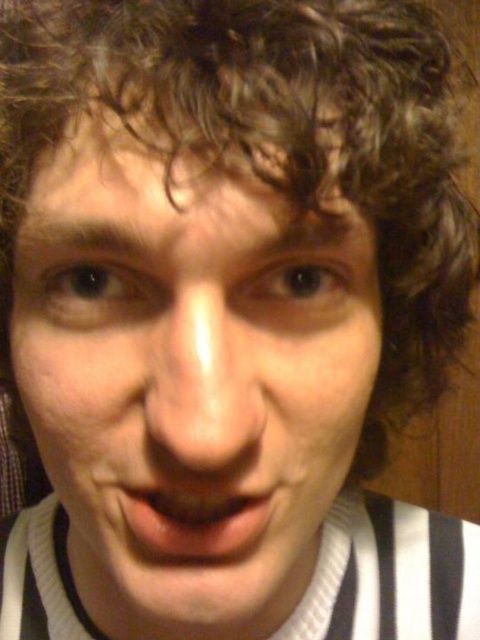
You are a makeup artist preparing to apply foundation. You have two areas to cover on the face shown in the image. Which area requires a larger amount of foundation, the smooth skin face at center or the smooth skin nose at center?

The smooth skin face at center is larger in size than the smooth skin nose at center, so it requires a larger amount of foundation.

You are a photographer adjusting lighting for a portrait. The subject has a smooth skin face at center and a smooth skin nose at center. Which part of the face should you focus on to highlight the texture of the nose without overexposing the face?

The smooth skin nose at center is positioned above the smooth skin face at center, so focusing on the nose area would allow you to highlight its texture while keeping the face from overexposure.

You are an artist trying to draw this face. You want to ensure that the two points, point (170, 340) and point (155, 522), are correctly placed in terms of depth. Which point should you draw closer to the viewer?

Point (170, 340) should be drawn closer to the viewer because it is closer than point (155, 522).